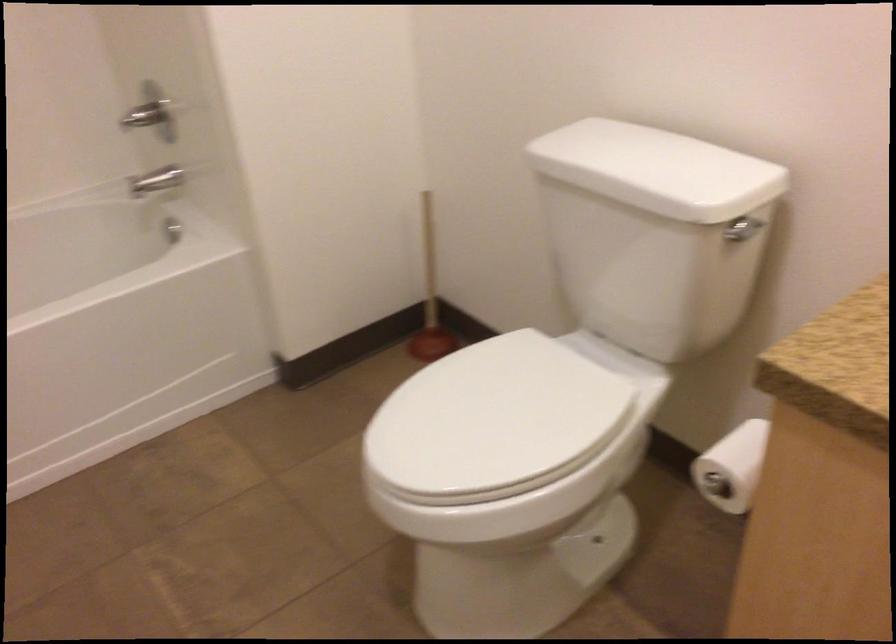
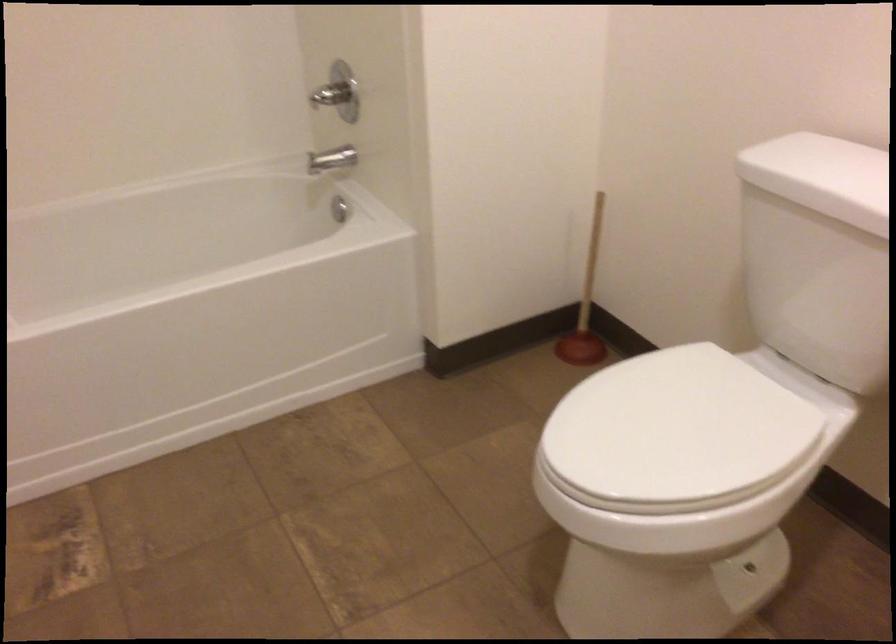
Question: What movement of the cameraman would produce the second image?

Choices:
 (A) Left
 (B) Right
 (C) Forward
 (D) Backward

Answer: (A)